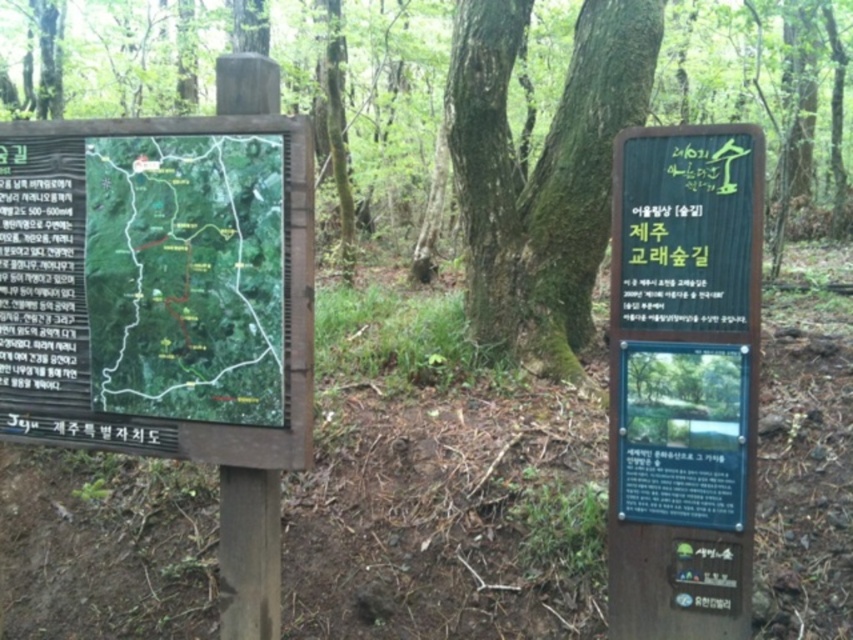
You are a hiker trying to navigate the forest and see two points marked on the map. The first point is at coordinates point (241, 134) and the second point is at point (490, 125). Which point is closer to you?

Point (241, 134) is in front of point (490, 125), so the first point is closer to you.